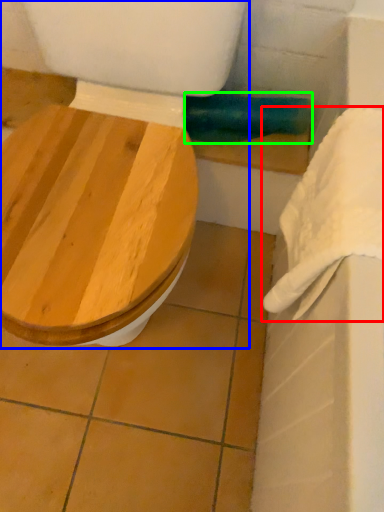
Question: Based on their relative distances, which object is farther from towel/napkin (highlighted by a red box)? Choose from toilet (highlighted by a blue box) and towel bar (highlighted by a green box).

Choices:
 (A) toilet
 (B) towel bar

Answer: (B)